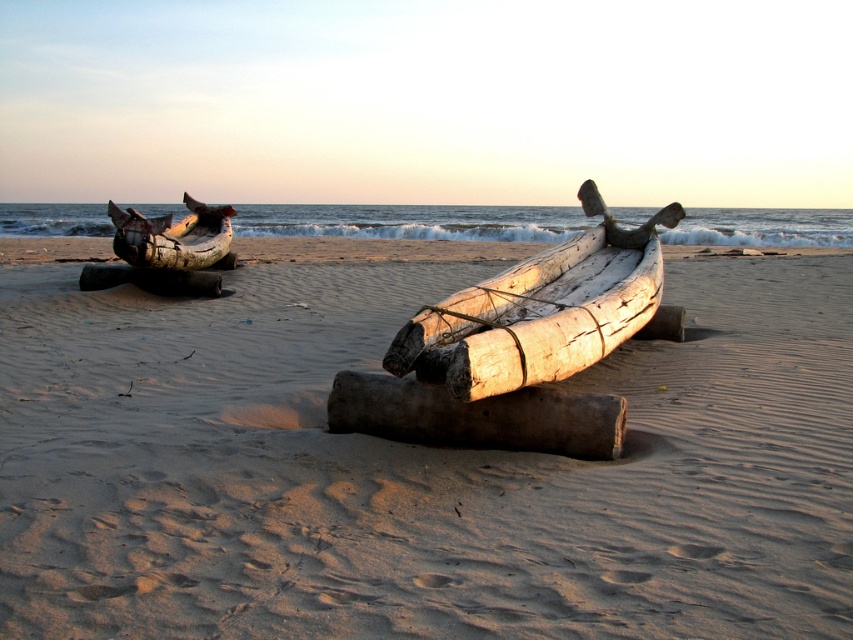
Question: Among these objects, which one is nearest to the camera?

Choices:
 (A) smooth sand at center
 (B) dark brown wood log at center
 (C) rusty metal canoe at left

Answer: (A)

Question: Can you confirm if dark brown wood log at center is positioned below rusty metal canoe at left?

Choices:
 (A) no
 (B) yes

Answer: (B)

Question: Which of these objects is positioned farthest from the light brown wooden boat at center?

Choices:
 (A) rusty metal canoe at left
 (B) smooth sand at center

Answer: (A)

Question: Which point is closer to the camera?

Choices:
 (A) (171, 230)
 (B) (543, 284)

Answer: (B)

Question: Is light brown wooden boat at center wider than dark brown wood log at center?

Choices:
 (A) yes
 (B) no

Answer: (B)

Question: Can you confirm if smooth sand at center is smaller than rusty metal canoe at left?

Choices:
 (A) yes
 (B) no

Answer: (B)